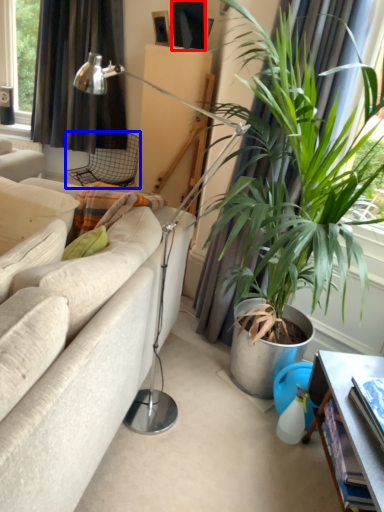
Question: Which of the following is the farthest to the observer, picture frame (highlighted by a red box) or chair (highlighted by a blue box)?

Choices:
 (A) picture frame
 (B) chair

Answer: (B)